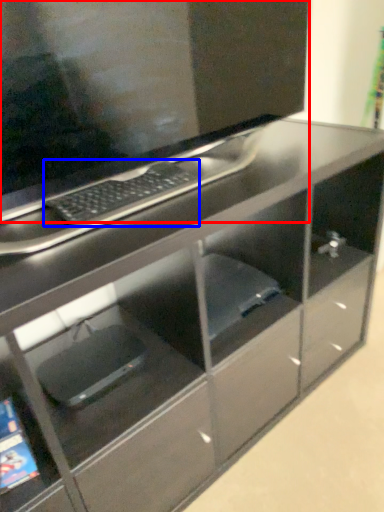
Question: Which object is further to the camera taking this photo, computer monitor (highlighted by a red box) or computer keyboard (highlighted by a blue box)?

Choices:
 (A) computer monitor
 (B) computer keyboard

Answer: (B)